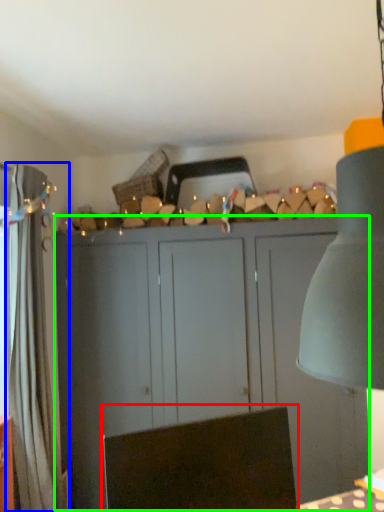
Question: Which is nearer to the swivel chair (highlighted by a red box)? curtain (highlighted by a blue box) or cupboard (highlighted by a green box).

Choices:
 (A) curtain
 (B) cupboard

Answer: (A)